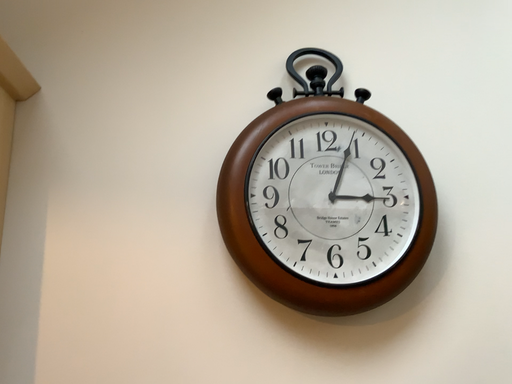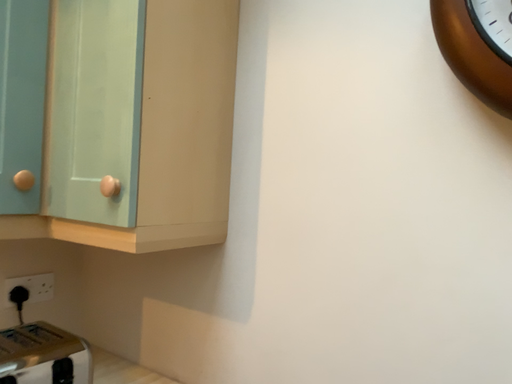
Question: How did the camera likely rotate when shooting the video?

Choices:
 (A) rotated left
 (B) rotated right

Answer: (A)